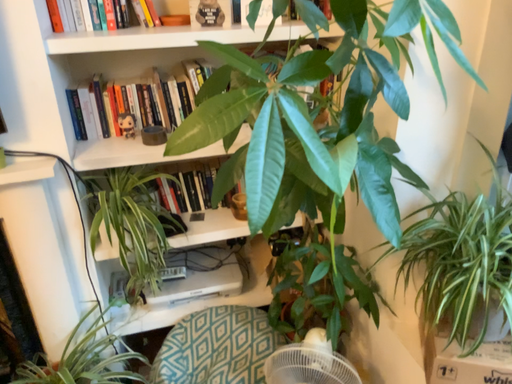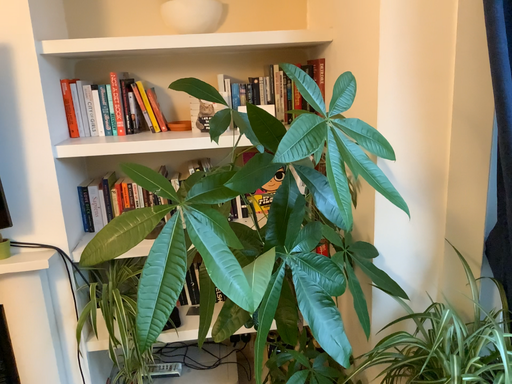
Question: How did the camera likely rotate when shooting the video?

Choices:
 (A) rotated right
 (B) rotated left

Answer: (B)